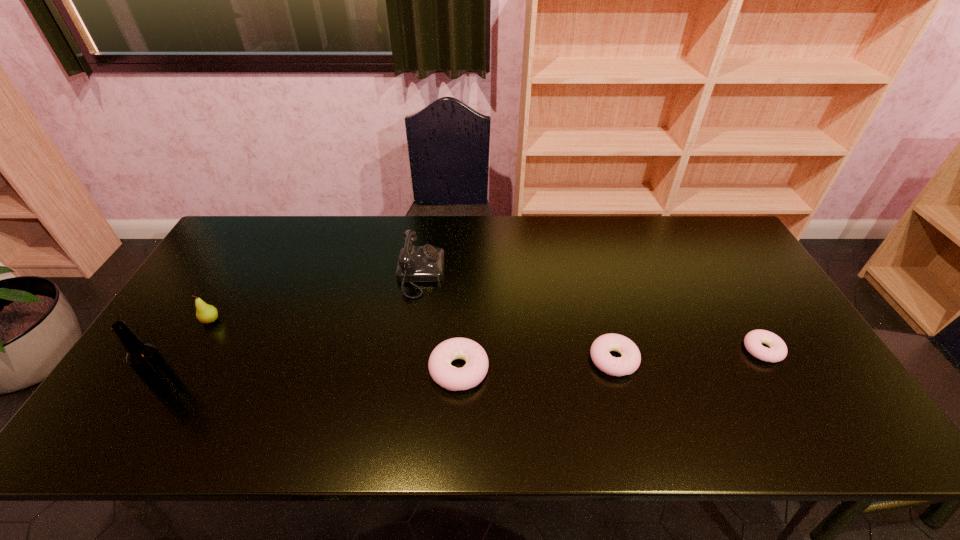
Where is `the leftmost doughnut`? The image size is (960, 540). the leftmost doughnut is located at coordinates (452, 378).

Identify the location of the fourth tallest object. The image size is (960, 540). (452, 378).

Where is `the second object from right to left`? Image resolution: width=960 pixels, height=540 pixels. the second object from right to left is located at coordinates (629, 362).

The width and height of the screenshot is (960, 540). I want to click on the second tallest doughnut, so click(x=629, y=362).

Locate an element on the screen. This screenshot has height=540, width=960. the shortest object is located at coordinates (777, 352).

Identify the location of the shortest doughnut. The height and width of the screenshot is (540, 960). (777, 352).

Where is `the second farthest object`? the second farthest object is located at coordinates pos(205,313).

Where is `telephone`? The image size is (960, 540). telephone is located at coordinates (425, 263).

Image resolution: width=960 pixels, height=540 pixels. I want to click on beer bottle, so click(x=145, y=359).

You are a GUI agent. You are given a task and a screenshot of the screen. Output one action in this format:
    pyautogui.click(x=<x>, y=<y>)
    Task: Click on the free space located 0.370m on the right of the tallest doughnut
    
    Given the screenshot: What is the action you would take?
    pyautogui.click(x=635, y=369)